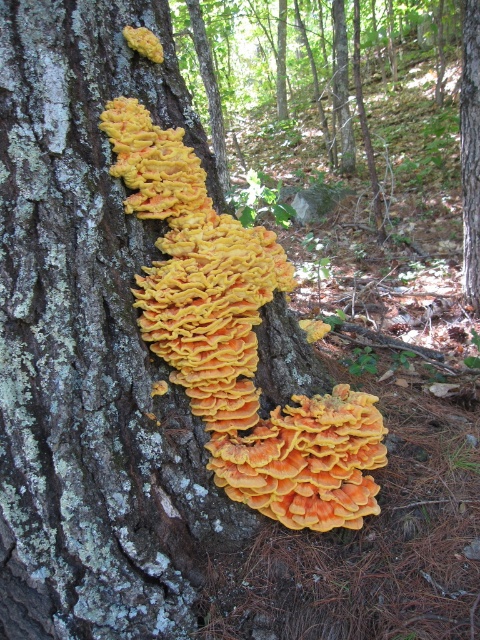
How distant is orange soft coral at center from smooth bark tree trunk at center?

2.17 meters

Does orange soft coral at center have a larger size compared to smooth bark tree trunk at center?

Correct, orange soft coral at center is larger in size than smooth bark tree trunk at center.

Between point (137, 184) and point (467, 220), which one is positioned in front?

Point (137, 184) is in front.

Find the location of `orange soft coral at center`. orange soft coral at center is located at coordinates 237,340.